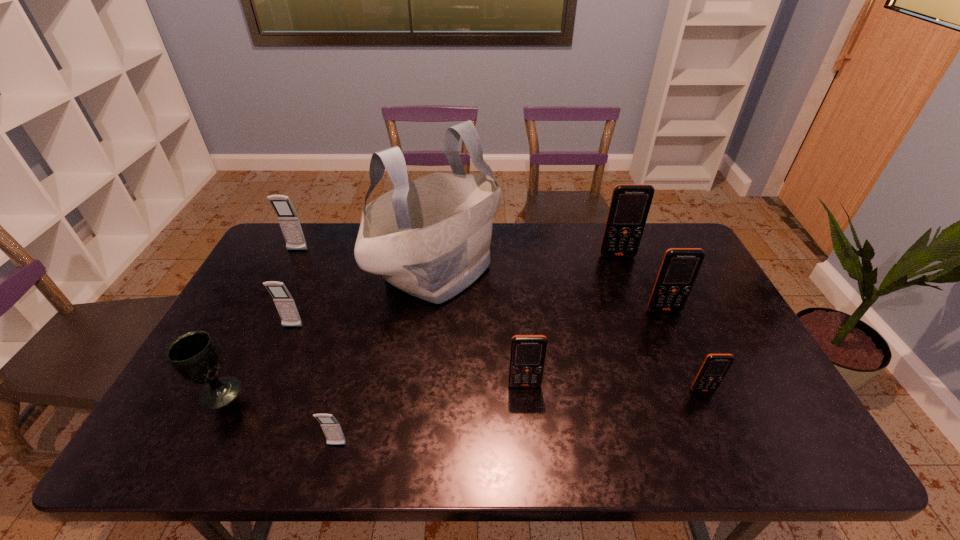
Where is `vacant area at the right edge of the desktop`? This screenshot has height=540, width=960. vacant area at the right edge of the desktop is located at coordinates (708, 308).

What are the coordinates of `vacant space at the far left corner of the desktop` in the screenshot? It's located at (272, 247).

Where is `free space that is in between the smallest orange cellular telephone and the chalice`? This screenshot has height=540, width=960. free space that is in between the smallest orange cellular telephone and the chalice is located at coordinates (461, 392).

The image size is (960, 540). I want to click on empty space between the third farthest cellular telephone and the second gray cellular telephone from right to left, so click(478, 319).

The image size is (960, 540). I want to click on vacant area that lies between the shopping bag and the second biggest orange cellular telephone, so click(x=551, y=290).

The width and height of the screenshot is (960, 540). I want to click on empty location between the second biggest gray cellular telephone and the second smallest orange cellular telephone, so click(x=409, y=356).

At what (x,y) coordinates should I click in order to perform the action: click on vacant area that lies between the second farthest orange cellular telephone and the fourth object from right to left. Please return your answer as a coordinate pair (x, y). Looking at the image, I should click on (594, 348).

This screenshot has width=960, height=540. Find the location of `vacant space in between the farthest orange cellular telephone and the third biggest orange cellular telephone`. vacant space in between the farthest orange cellular telephone and the third biggest orange cellular telephone is located at coordinates (571, 320).

Find the location of a particular element. vacant area that lies between the biggest gray cellular telephone and the chalice is located at coordinates point(258,321).

Identify the location of unoccupied area between the second biggest orange cellular telephone and the second tallest object. The image size is (960, 540). (641, 283).